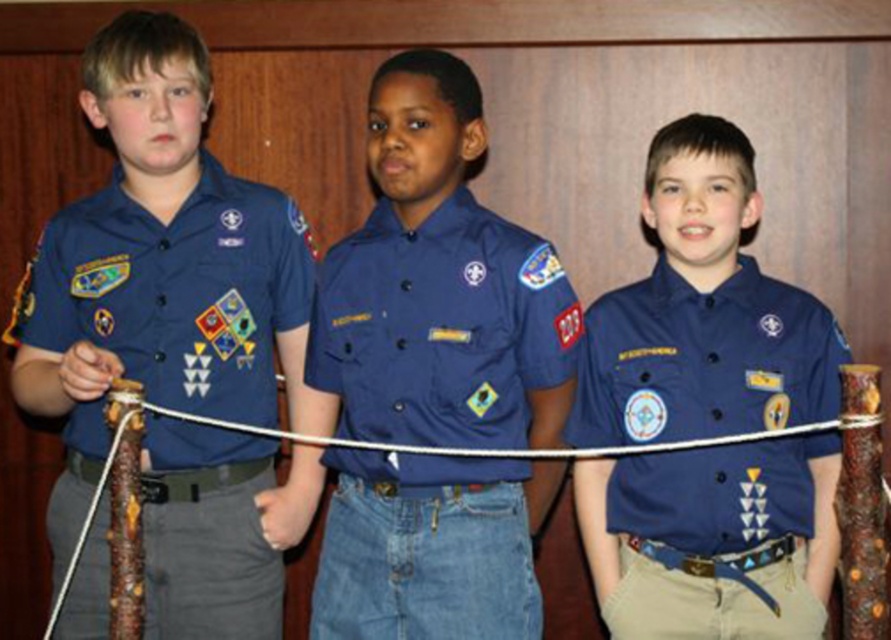
Question: Is blue cotton shirt at center closer to camera compared to matte blue shirt at left?

Choices:
 (A) no
 (B) yes

Answer: (A)

Question: Which point is closer to the camera?

Choices:
 (A) (166, 516)
 (B) (505, 621)

Answer: (B)

Question: Which point is closer to the camera?

Choices:
 (A) matte blue shirt at left
 (B) blue cotton shirt at center

Answer: (A)

Question: Among these objects, which one is nearest to the camera?

Choices:
 (A) matte blue shirt at left
 (B) blue cotton shirt at center
 (C) matte blue shirt at center

Answer: (A)

Question: Can you confirm if blue cotton shirt at center is positioned to the right of matte blue shirt at left?

Choices:
 (A) no
 (B) yes

Answer: (B)

Question: Does blue cotton shirt at center come in front of matte blue shirt at center?

Choices:
 (A) yes
 (B) no

Answer: (A)